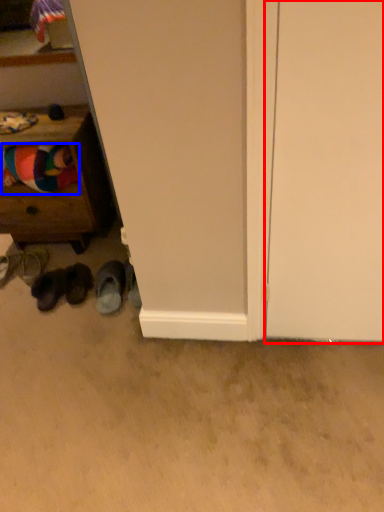
Question: Which object is closer to the camera taking this photo, door (highlighted by a red box) or clothing (highlighted by a blue box)?

Choices:
 (A) door
 (B) clothing

Answer: (A)